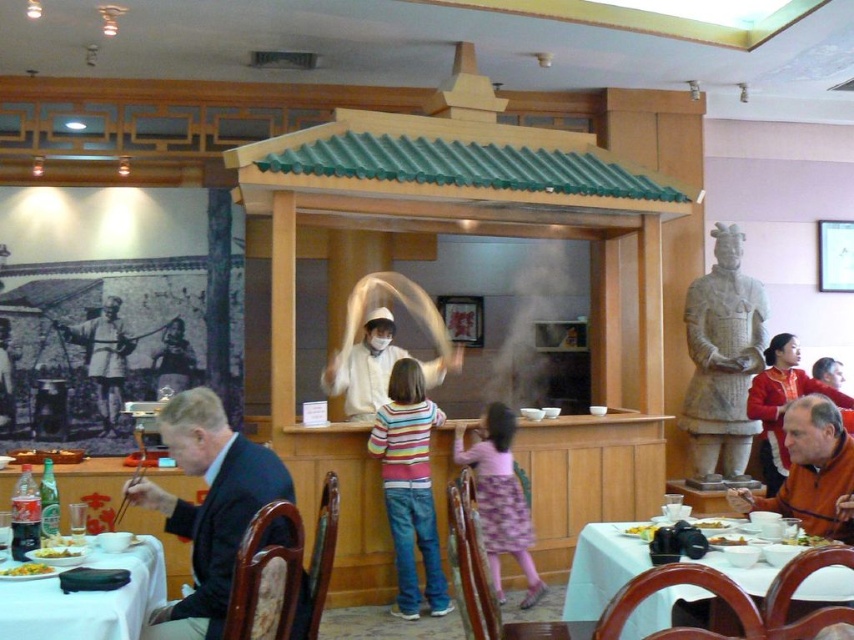
From the picture: Does orange fabric shirt at right have a larger size compared to yellowish matte rice at table right?

Yes, orange fabric shirt at right is bigger than yellowish matte rice at table right.

Based on the photo, does orange fabric shirt at right appear on the left side of yellowish matte rice at table right?

In fact, orange fabric shirt at right is to the right of yellowish matte rice at table right.

The width and height of the screenshot is (854, 640). Identify the location of orange fabric shirt at right. point(781,403).

Find the location of a particular element. Image resolution: width=854 pixels, height=640 pixels. orange fabric shirt at right is located at coordinates (781, 403).

Who is positioned more to the right, pink floral dress at center or wooden figure at center?

Positioned to the right is pink floral dress at center.

Is pink floral dress at center to the right of wooden figure at center from the viewer's perspective?

Yes, pink floral dress at center is to the right of wooden figure at center.

Is point (506, 456) farther from viewer compared to point (112, 296)?

That is False.

Locate an element on the screen. The image size is (854, 640). pink floral dress at center is located at coordinates (500, 499).

Is gray stone statue at right to the right of white glossy table at lower left from the viewer's perspective?

Correct, you'll find gray stone statue at right to the right of white glossy table at lower left.

How distant is gray stone statue at right from white glossy table at lower left?

A distance of 4.23 meters exists between gray stone statue at right and white glossy table at lower left.

From the picture: Who is more distant from viewer, (736, 280) or (132, 637)?

Positioned behind is point (736, 280).

Identify the location of gray stone statue at right. (722, 356).